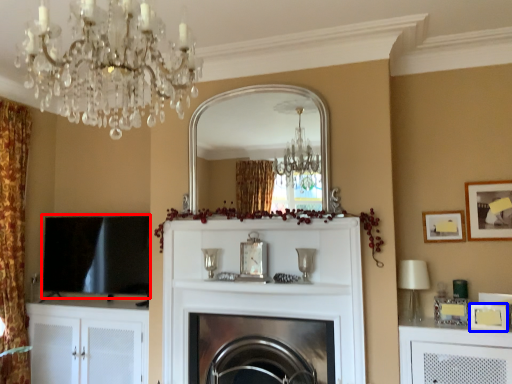
Question: Which of the following is the farthest to the observer, window screen (highlighted by a red box) or picture frame (highlighted by a blue box)?

Choices:
 (A) window screen
 (B) picture frame

Answer: (A)